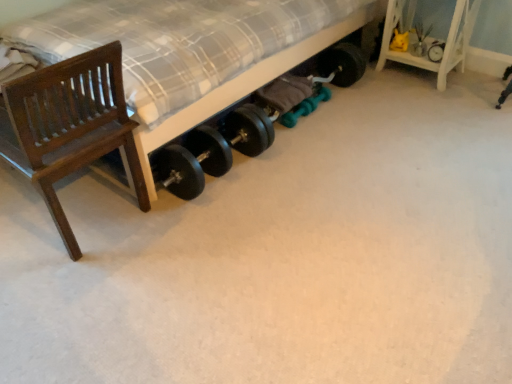
Question: Is dark wood chair at left facing towards matte black dumbbells at lower center?

Choices:
 (A) no
 (B) yes

Answer: (A)

Question: Considering the relative sizes of dark wood chair at left and matte black dumbbells at lower center in the image provided, is dark wood chair at left wider than matte black dumbbells at lower center?

Choices:
 (A) yes
 (B) no

Answer: (B)

Question: Does dark wood chair at left have a smaller size compared to matte black dumbbells at lower center?

Choices:
 (A) yes
 (B) no

Answer: (A)

Question: From the image's perspective, would you say dark wood chair at left is positioned over matte black dumbbells at lower center?

Choices:
 (A) no
 (B) yes

Answer: (A)

Question: Does dark wood chair at left have a larger size compared to matte black dumbbells at lower center?

Choices:
 (A) no
 (B) yes

Answer: (A)

Question: From their relative heights in the image, would you say white wood shelf at upper right is taller or shorter than matte black dumbbells at lower center?

Choices:
 (A) tall
 (B) short

Answer: (B)

Question: Does point (468, 3) appear closer or farther from the camera than point (148, 150)?

Choices:
 (A) closer
 (B) farther

Answer: (B)

Question: Is white wood shelf at upper right bigger or smaller than matte black dumbbells at lower center?

Choices:
 (A) big
 (B) small

Answer: (B)

Question: Is white wood shelf at upper right in front of or behind matte black dumbbells at lower center in the image?

Choices:
 (A) front
 (B) behind

Answer: (B)

Question: Considering the positions of white wood shelf at upper right and dark wood chair at left in the image, is white wood shelf at upper right bigger or smaller than dark wood chair at left?

Choices:
 (A) small
 (B) big

Answer: (A)

Question: Is point (461, 31) positioned closer to the camera than point (130, 135)?

Choices:
 (A) farther
 (B) closer

Answer: (A)

Question: Is white wood shelf at upper right inside the boundaries of dark wood chair at left, or outside?

Choices:
 (A) inside
 (B) outside

Answer: (B)

Question: From the image's perspective, is white wood shelf at upper right positioned above or below dark wood chair at left?

Choices:
 (A) above
 (B) below

Answer: (A)

Question: Considering the positions of white wood shelf at upper right and black rubber tire at upper right in the image, is white wood shelf at upper right taller or shorter than black rubber tire at upper right?

Choices:
 (A) tall
 (B) short

Answer: (A)

Question: From a real-world perspective, is white wood shelf at upper right above or below black rubber tire at upper right?

Choices:
 (A) below
 (B) above

Answer: (B)